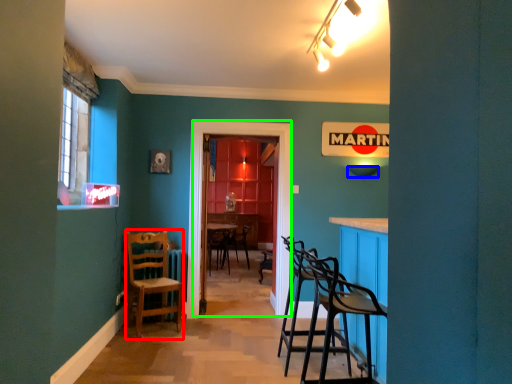
Question: Considering the real-world distances, which object is closest to chair (highlighted by a red box)? lampshade (highlighted by a blue box) or glass door (highlighted by a green box).

Choices:
 (A) lampshade
 (B) glass door

Answer: (B)